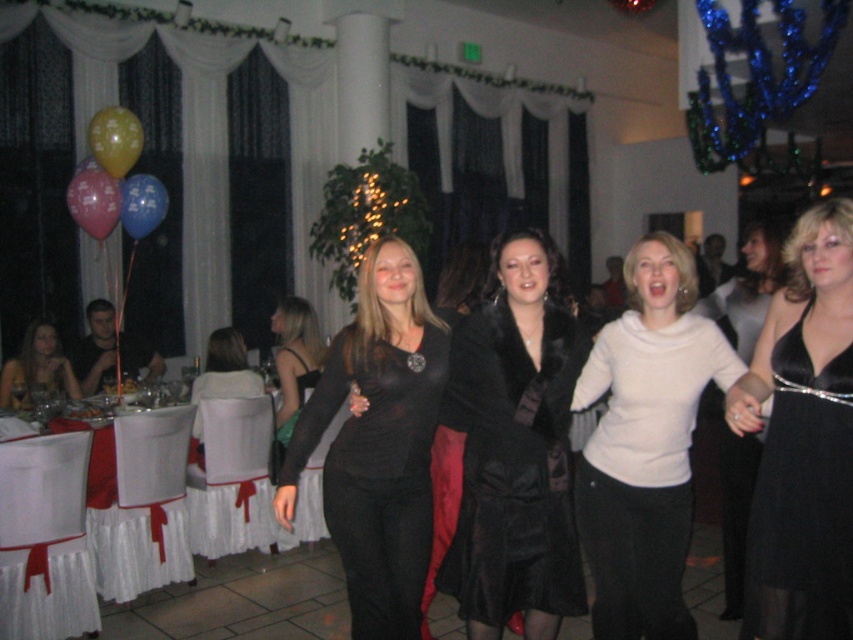
What do you see at coordinates (515, 449) in the screenshot? I see `black velvet coat at center` at bounding box center [515, 449].

Which is in front, point (485, 486) or point (737, 285)?

Point (485, 486) is in front.

Measure the distance between black velvet coat at center and camera.

black velvet coat at center is 2.49 meters away from camera.

I want to click on black velvet coat at center, so click(515, 449).

Who is positioned more to the right, black satin dress at lower right or yellow rubber balloon at upper left?

Positioned to the right is black satin dress at lower right.

Is black satin dress at lower right positioned behind yellow rubber balloon at upper left?

No.

Who is more forward, [759,472] or [138,132]?

Point [759,472]

Locate an element on the screen. This screenshot has height=640, width=853. black satin dress at lower right is located at coordinates (802, 500).

Is black satin dress at lower right bigger than black satin dress at center?

Incorrect, black satin dress at lower right is not larger than black satin dress at center.

Is point (775, 381) positioned in front of point (730, 300)?

Yes, point (775, 381) is in front of point (730, 300).

Does point (804, 577) come in front of point (727, 307)?

That is True.

Image resolution: width=853 pixels, height=640 pixels. I want to click on black satin dress at lower right, so click(802, 500).